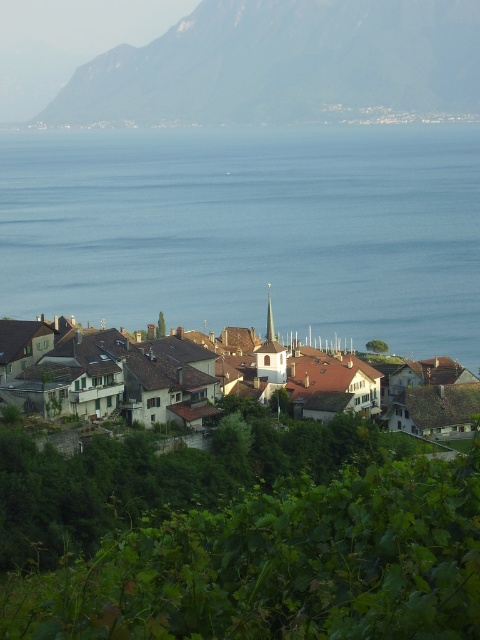
Find the location of a particular element. rocky gray mountain at upper center is located at coordinates (285, 65).

Which of these two, rocky gray mountain at upper center or smooth gray spire at center, stands taller?

rocky gray mountain at upper center is taller.

You are a GUI agent. You are given a task and a screenshot of the screen. Output one action in this format:
    pyautogui.click(x=<x>, y=<y>)
    Task: Click on the rocky gray mountain at upper center
    
    Given the screenshot: What is the action you would take?
    (x=285, y=65)

Does point (0, 326) come behind point (271, 305)?

No, it is not.

Is brown tiled roofs at center closer to the viewer compared to smooth gray spire at center?

Yes, brown tiled roofs at center is closer to the viewer.

Between point (253, 369) and point (268, 296), which one is positioned in front?

Positioned in front is point (253, 369).

The image size is (480, 640). Find the location of `brown tiled roofs at center`. brown tiled roofs at center is located at coordinates (106, 372).

Who is more forward, (380, 300) or (274, 3)?

Positioned in front is point (380, 300).

At what (x,y) coordinates should I click in order to perform the action: click on blue water at center. Please return your answer as a coordinate pair (x, y). Image resolution: width=480 pixels, height=640 pixels. Looking at the image, I should click on (250, 230).